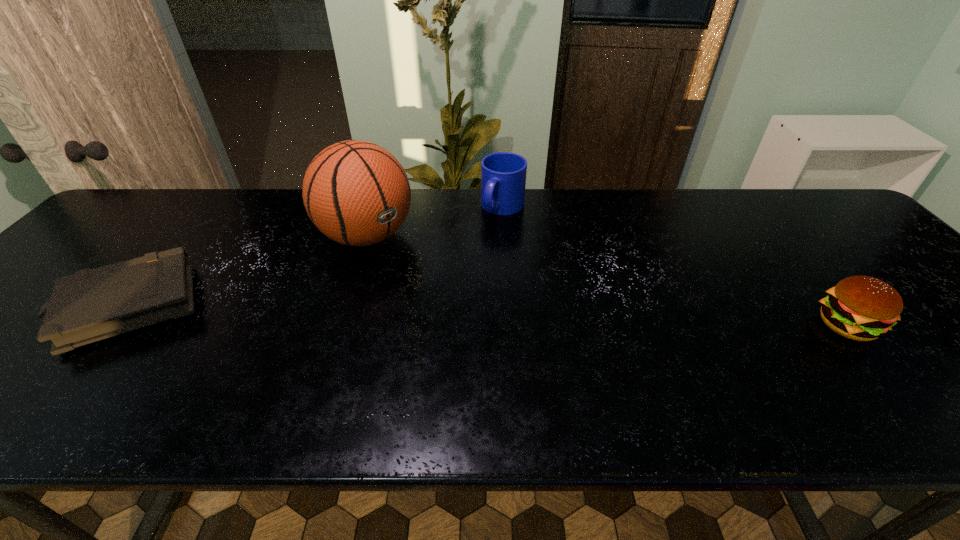
You are a GUI agent. You are given a task and a screenshot of the screen. Output one action in this format:
    pyautogui.click(x=<x>, y=<y>)
    Task: Click on the free space on the desktop that is between the Bible and the rightmost object and is positioned on the side with the handle of the mug
    
    Given the screenshot: What is the action you would take?
    pyautogui.click(x=419, y=316)

In order to click on free space on the desktop that is between the Bible and the hamburger and is positioned on the side where the inflation valve is located in this screenshot , I will do `click(468, 318)`.